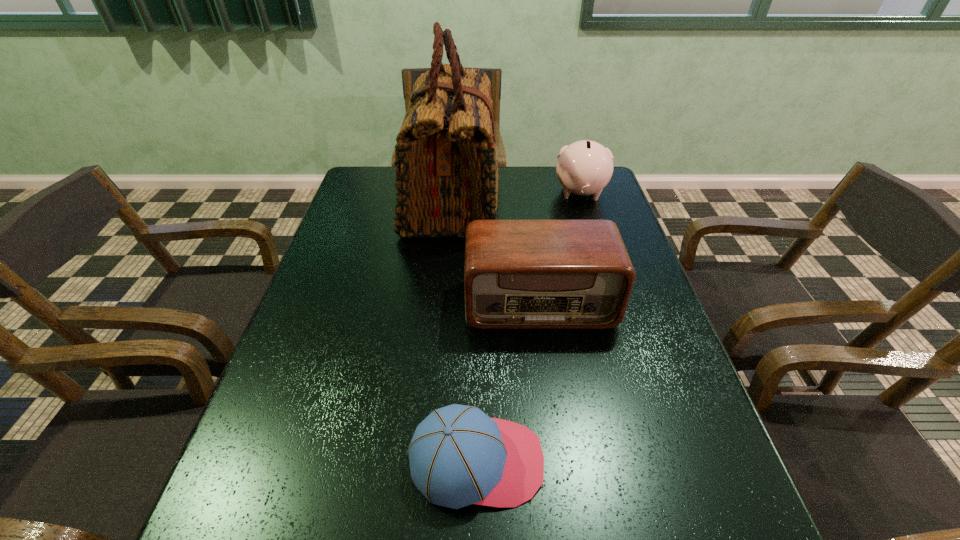
Where is `empty space that is in between the shortest object and the second nearest object`? The image size is (960, 540). empty space that is in between the shortest object and the second nearest object is located at coordinates (508, 382).

The height and width of the screenshot is (540, 960). In order to click on free spot between the tallest object and the baseball cap in this screenshot , I will do `click(465, 332)`.

This screenshot has width=960, height=540. What are the coordinates of `vacant area between the radio receiver and the nearest object` in the screenshot? It's located at (508, 382).

Find the location of `the third closest object to the tallest object`. the third closest object to the tallest object is located at coordinates (458, 456).

The width and height of the screenshot is (960, 540). Identify the location of object identified as the closest to the piggy bank. (446, 169).

Where is `free location that satisfies the following two spatial constraints: 1. on the front panel of the second nearest object; 2. on the front-facing side of the nearest object`? The height and width of the screenshot is (540, 960). free location that satisfies the following two spatial constraints: 1. on the front panel of the second nearest object; 2. on the front-facing side of the nearest object is located at coordinates (562, 462).

Where is `vacant space that satisfies the following two spatial constraints: 1. on the front panel of the radio receiver; 2. on the front-facing side of the shortest object`? This screenshot has height=540, width=960. vacant space that satisfies the following two spatial constraints: 1. on the front panel of the radio receiver; 2. on the front-facing side of the shortest object is located at coordinates (562, 462).